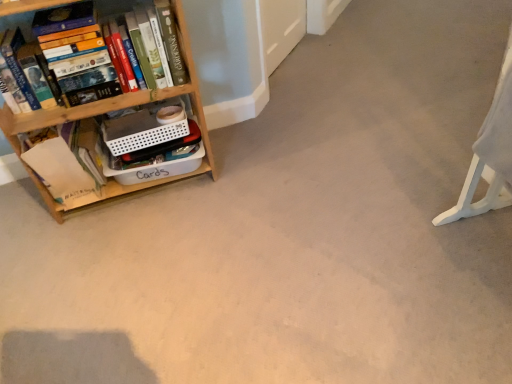
Where is `empty space that is to the right of wooden bookshelf at left`? The width and height of the screenshot is (512, 384). empty space that is to the right of wooden bookshelf at left is located at coordinates (248, 177).